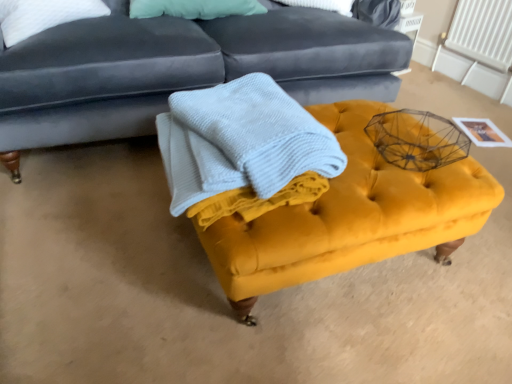
Question: From a real-world perspective, is velvet yellow ottoman at center physically above white plastic radiator at upper right?

Choices:
 (A) yes
 (B) no

Answer: (B)

Question: Can white plastic radiator at upper right be found inside velvet yellow ottoman at center?

Choices:
 (A) yes
 (B) no

Answer: (B)

Question: Considering the relative positions of velvet yellow ottoman at center and white plastic radiator at upper right in the image provided, is velvet yellow ottoman at center to the right of white plastic radiator at upper right from the viewer's perspective?

Choices:
 (A) yes
 (B) no

Answer: (B)

Question: Is velvet yellow ottoman at center further to camera compared to white plastic radiator at upper right?

Choices:
 (A) no
 (B) yes

Answer: (A)

Question: Is velvet yellow ottoman at center not within white plastic radiator at upper right?

Choices:
 (A) no
 (B) yes

Answer: (B)

Question: Is velvet yellow ottoman at center at the left side of white plastic radiator at upper right?

Choices:
 (A) yes
 (B) no

Answer: (A)

Question: From the image's perspective, is velvet dark blue studio couch at upper center located beneath white plastic radiator at upper right?

Choices:
 (A) no
 (B) yes

Answer: (B)

Question: Can you confirm if velvet dark blue studio couch at upper center is bigger than white plastic radiator at upper right?

Choices:
 (A) no
 (B) yes

Answer: (B)

Question: Does velvet dark blue studio couch at upper center lie in front of white plastic radiator at upper right?

Choices:
 (A) no
 (B) yes

Answer: (B)

Question: From a real-world perspective, is velvet dark blue studio couch at upper center physically above white plastic radiator at upper right?

Choices:
 (A) no
 (B) yes

Answer: (B)

Question: From a real-world perspective, is velvet dark blue studio couch at upper center positioned under white plastic radiator at upper right based on gravity?

Choices:
 (A) no
 (B) yes

Answer: (A)

Question: Can you confirm if velvet dark blue studio couch at upper center is positioned to the right of white plastic radiator at upper right?

Choices:
 (A) no
 (B) yes

Answer: (A)

Question: Is light blue textured blanket at center thinner than velvet yellow ottoman at center?

Choices:
 (A) yes
 (B) no

Answer: (A)